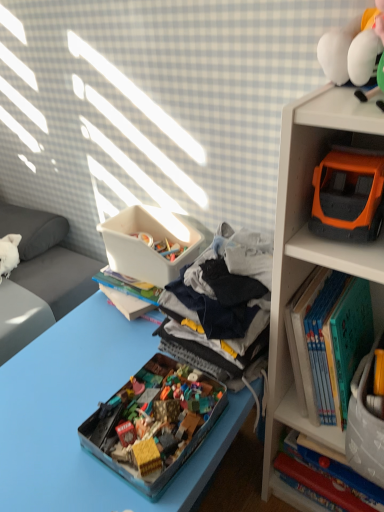
Question: From the image's perspective, is translucent plastic toy box at center located above or below blue plastic tray at center?

Choices:
 (A) above
 (B) below

Answer: (A)

Question: In the image, is translucent plastic toy box at center positioned in front of or behind blue plastic tray at center?

Choices:
 (A) front
 (B) behind

Answer: (B)

Question: Which object is the closest to the hardcover book at upper right, placed as the second book when sorted from bottom to top?

Choices:
 (A) blue plastic tray at center
 (B) gray cotton clothes at center
 (C) orange plastic toy car at upper right
 (D) translucent plastic toy box at center
 (E) orange plastic toy truck at upper right

Answer: (C)

Question: Based on their relative distances, which object is nearer to the gray cotton clothes at center?

Choices:
 (A) orange plastic toy truck at upper right
 (B) orange plastic toy car at upper right
 (C) hardcover book at upper right, placed as the second book when sorted from bottom to top
 (D) blue plastic tray at center
 (E) translucent plastic toy box at center

Answer: (B)